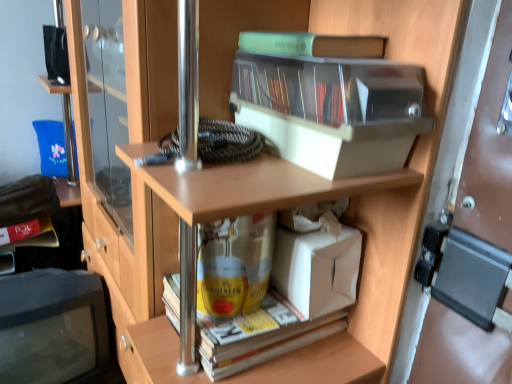
Question: From a real-world perspective, is matte yellow book at lower left, the 2th book in the bottom-to-top sequence, above or below green plastic book at upper center, the first book positioned from the top?

Choices:
 (A) above
 (B) below

Answer: (B)

Question: From the image's perspective, is matte yellow book at lower left, which appears as the second book when viewed from the top, above or below green plastic book at upper center, the first book positioned from the top?

Choices:
 (A) above
 (B) below

Answer: (B)

Question: Estimate the real-world distances between objects in this image. Which object is farther from the green plastic book at upper center, arranged as the third book when viewed from the left?

Choices:
 (A) white cardboard box at lower center
 (B) matte yellow book at lower left, positioned as the 1th book in back-to-front order
 (C) yellow paperback book at lower center, which is counted as the second book, starting from the front
 (D) matte black monitor at lower left
 (E) transparent plastic storage box at upper center

Answer: (B)

Question: Estimate the real-world distances between objects in this image. Which object is farther from the green plastic book at upper center, the 1th book viewed from the front?

Choices:
 (A) yellow paperback book at lower center, which is the first book from bottom to top
 (B) matte yellow book at lower left, positioned as the 1th book in back-to-front order
 (C) matte black monitor at lower left
 (D) white cardboard box at lower center
 (E) transparent plastic storage box at upper center

Answer: (B)